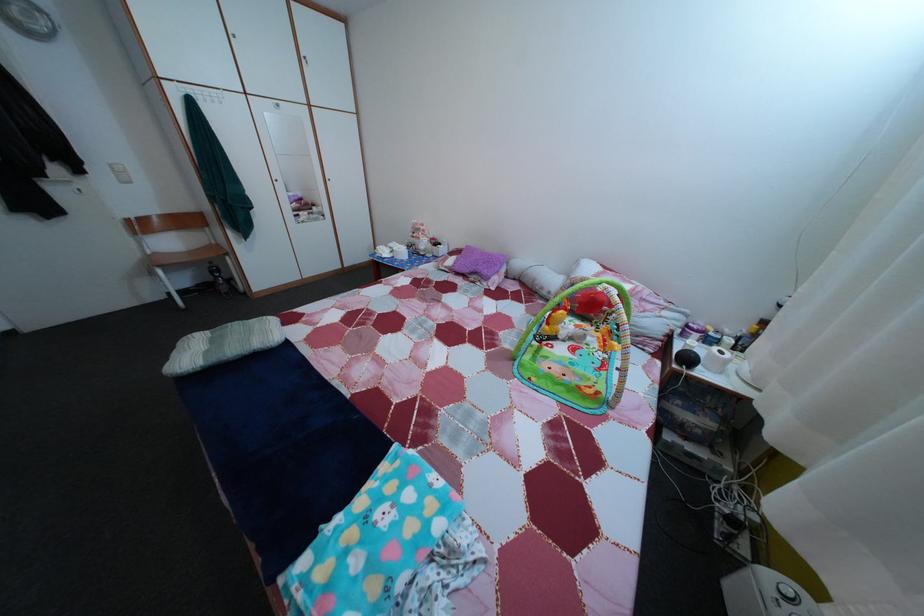
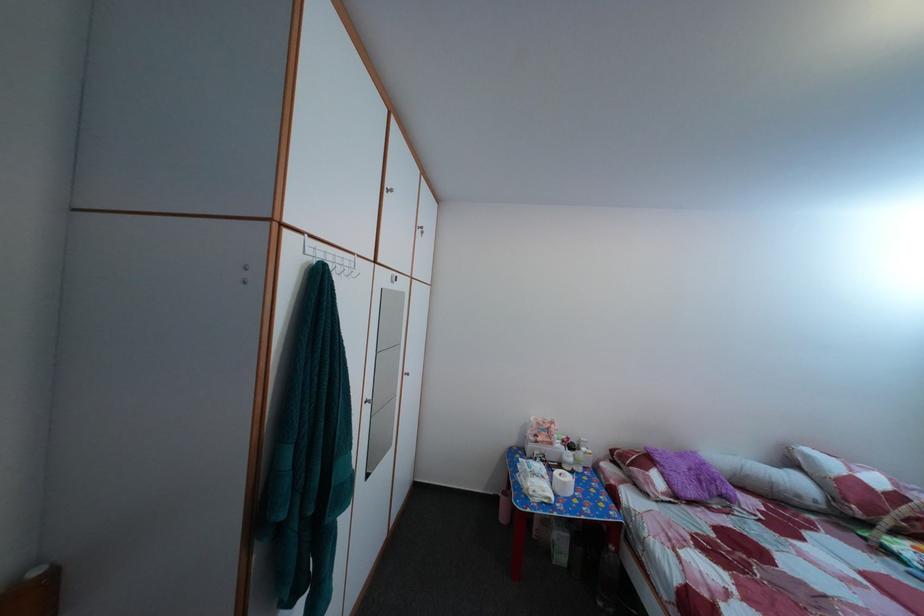
Where in the second image is the point corresponding to point (552, 296) from the first image?

(808, 504)